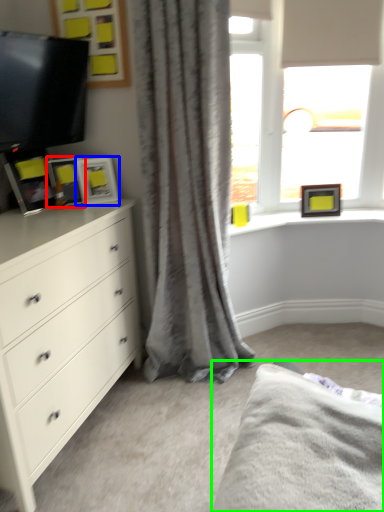
Question: Based on their relative distances, which object is farther from picture frame (highlighted by a red box)? Choose from picture frame (highlighted by a blue box) and bed frame (highlighted by a green box).

Choices:
 (A) picture frame
 (B) bed frame

Answer: (B)